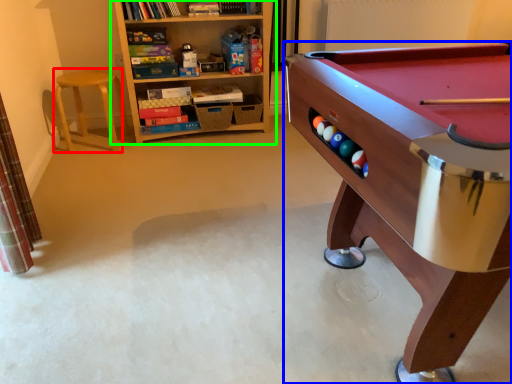
Question: Considering the real-world distances, which object is closest to stool (highlighted by a red box)? table (highlighted by a blue box) or bookcase (highlighted by a green box).

Choices:
 (A) table
 (B) bookcase

Answer: (B)